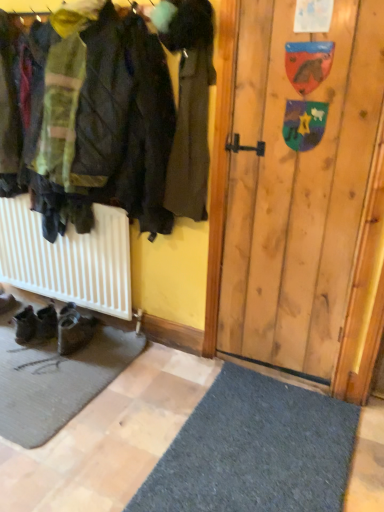
This screenshot has height=512, width=384. Find the location of `black leather shoes at lower left, the 2th footwear from the left`. black leather shoes at lower left, the 2th footwear from the left is located at coordinates (74, 329).

Identify the location of black leather shoes at lower left, which appears as the 1th footwear when viewed from the right. (74, 329).

Find the location of a particular element. jacket in front of the black leather shoes at lower left, which appears as the 1th footwear when viewed from the right is located at coordinates (190, 105).

Between dark brown leather coat at center and black leather shoes at lower left, the 2th footwear from the left, which one has more height?

Standing taller between the two is dark brown leather coat at center.

Which object is positioned more to the left, dark brown leather coat at center or black leather shoes at lower left, which appears as the 1th footwear when viewed from the right?

From the viewer's perspective, black leather shoes at lower left, which appears as the 1th footwear when viewed from the right, appears more on the left side.

Is dark brown leather coat at center surrounding black leather shoes at lower left, the 2th footwear from the left?

Actually, black leather shoes at lower left, the 2th footwear from the left, is outside dark brown leather coat at center.

Considering the positions of objects black leather shoes at lower left, which appears as the 1th footwear when viewed from the right, and dark brown leather coat at center in the image provided, who is more to the left, black leather shoes at lower left, which appears as the 1th footwear when viewed from the right, or dark brown leather coat at center?

Positioned to the left is black leather shoes at lower left, which appears as the 1th footwear when viewed from the right.

Considering the relative sizes of black leather shoes at lower left, the 2th footwear from the left, and dark brown leather coat at center in the image provided, is black leather shoes at lower left, the 2th footwear from the left, bigger than dark brown leather coat at center?

No, black leather shoes at lower left, the 2th footwear from the left, is not bigger than dark brown leather coat at center.

Considering the relative sizes of black leather shoes at lower left, which appears as the 1th footwear when viewed from the right, and dark brown leather coat at center in the image provided, is black leather shoes at lower left, which appears as the 1th footwear when viewed from the right, shorter than dark brown leather coat at center?

Correct, black leather shoes at lower left, which appears as the 1th footwear when viewed from the right, is not as tall as dark brown leather coat at center.

Can you confirm if black leather shoes at lower left, which appears as the 1th footwear when viewed from the right, is thinner than dark brown leather coat at center?

In fact, black leather shoes at lower left, which appears as the 1th footwear when viewed from the right, might be wider than dark brown leather coat at center.

Is black leather shoes at lower left, the 2th footwear from the left, a part of brown suede boots at lower left, the second footwear in the right-to-left sequence?

No.

Between brown suede boots at lower left, the second footwear in the right-to-left sequence, and black leather shoes at lower left, the 2th footwear from the left, which one has smaller size?

With smaller size is brown suede boots at lower left, the second footwear in the right-to-left sequence.

Looking at this image, which point is more forward, (37, 317) or (63, 346)?

The point (63, 346) is in front.

From a real-world perspective, relative to black leather shoes at lower left, which appears as the 1th footwear when viewed from the right, is brown suede boots at lower left, the first footwear when ordered from left to right, vertically above or below?

Clearly, from a real-world perspective, brown suede boots at lower left, the first footwear when ordered from left to right, is below black leather shoes at lower left, which appears as the 1th footwear when viewed from the right.

Identify the location of footwear above the black leather shoes at lower left, which appears as the 1th footwear when viewed from the right (from the image's perspective). This screenshot has width=384, height=512. (35, 324).

Based on the photo, from the image's perspective, is black leather shoes at lower left, the 2th footwear from the left, below brown suede boots at lower left, the second footwear in the right-to-left sequence?

Correct, black leather shoes at lower left, the 2th footwear from the left, appears lower than brown suede boots at lower left, the second footwear in the right-to-left sequence, in the image.

From a real-world perspective, which is physically above, black leather shoes at lower left, the 2th footwear from the left, or brown suede boots at lower left, the first footwear when ordered from left to right?

black leather shoes at lower left, the 2th footwear from the left, from a real-world perspective.

Between black leather shoes at lower left, which appears as the 1th footwear when viewed from the right, and brown suede boots at lower left, the first footwear when ordered from left to right, which one appears on the right side from the viewer's perspective?

black leather shoes at lower left, which appears as the 1th footwear when viewed from the right.

Does dark brown leather coat at center have a larger size compared to brown suede boots at lower left, the second footwear in the right-to-left sequence?

Correct, dark brown leather coat at center is larger in size than brown suede boots at lower left, the second footwear in the right-to-left sequence.

Considering the sizes of dark brown leather coat at center and brown suede boots at lower left, the first footwear when ordered from left to right, in the image, is dark brown leather coat at center taller or shorter than brown suede boots at lower left, the first footwear when ordered from left to right,?

In the image, dark brown leather coat at center appears to be taller than brown suede boots at lower left, the first footwear when ordered from left to right.

From a real-world perspective, is dark brown leather coat at center positioned over brown suede boots at lower left, the first footwear when ordered from left to right, based on gravity?

Correct, in the physical world, dark brown leather coat at center is higher than brown suede boots at lower left, the first footwear when ordered from left to right.

From a real-world perspective, which object rests below the other?

brown suede boots at lower left, the first footwear when ordered from left to right.

Considering the relative sizes of brown suede boots at lower left, the second footwear in the right-to-left sequence, and dark brown leather coat at center in the image provided, is brown suede boots at lower left, the second footwear in the right-to-left sequence, thinner than dark brown leather coat at center?

In fact, brown suede boots at lower left, the second footwear in the right-to-left sequence, might be wider than dark brown leather coat at center.

From the image's perspective, would you say brown suede boots at lower left, the first footwear when ordered from left to right, is shown under dark brown leather coat at center?

Correct, brown suede boots at lower left, the first footwear when ordered from left to right, appears lower than dark brown leather coat at center in the image.

This screenshot has width=384, height=512. I want to click on the 1st footwear behind the dark brown leather coat at center, so click(74, 329).

Where is `the 1st footwear located beneath the dark brown leather coat at center (from a real-world perspective)`? This screenshot has width=384, height=512. the 1st footwear located beneath the dark brown leather coat at center (from a real-world perspective) is located at coordinates (74, 329).

Estimate the real-world distances between objects in this image. Which object is further from dark brown leather coat at center, brown suede boots at lower left, the second footwear in the right-to-left sequence, or black leather shoes at lower left, which appears as the 1th footwear when viewed from the right?

Based on the image, brown suede boots at lower left, the second footwear in the right-to-left sequence, appears to be further to dark brown leather coat at center.

Based on their spatial positions, is black leather shoes at lower left, the 2th footwear from the left, or brown suede boots at lower left, the second footwear in the right-to-left sequence, closer to dark brown leather coat at center?

black leather shoes at lower left, the 2th footwear from the left, is closer to dark brown leather coat at center.

From the image, which object appears to be nearer to black leather shoes at lower left, the 2th footwear from the left, brown suede boots at lower left, the first footwear when ordered from left to right, or dark brown leather coat at center?

brown suede boots at lower left, the first footwear when ordered from left to right, is closer to black leather shoes at lower left, the 2th footwear from the left.

Estimate the real-world distances between objects in this image. Which object is closer to brown suede boots at lower left, the first footwear when ordered from left to right, dark brown leather coat at center or black leather shoes at lower left, the 2th footwear from the left?

black leather shoes at lower left, the 2th footwear from the left, is positioned closer to the anchor brown suede boots at lower left, the first footwear when ordered from left to right.

Based on their spatial positions, is dark brown leather coat at center or brown suede boots at lower left, the second footwear in the right-to-left sequence, further from black leather shoes at lower left, which appears as the 1th footwear when viewed from the right?

Among the two, dark brown leather coat at center is located further to black leather shoes at lower left, which appears as the 1th footwear when viewed from the right.

Based on their spatial positions, is black leather shoes at lower left, which appears as the 1th footwear when viewed from the right, or dark brown leather coat at center closer to brown suede boots at lower left, the first footwear when ordered from left to right?

black leather shoes at lower left, which appears as the 1th footwear when viewed from the right, lies closer to brown suede boots at lower left, the first footwear when ordered from left to right, than the other object.

I want to click on footwear that lies between dark brown leather coat at center and black leather shoes at lower left, the 2th footwear from the left, from top to bottom, so click(35, 324).